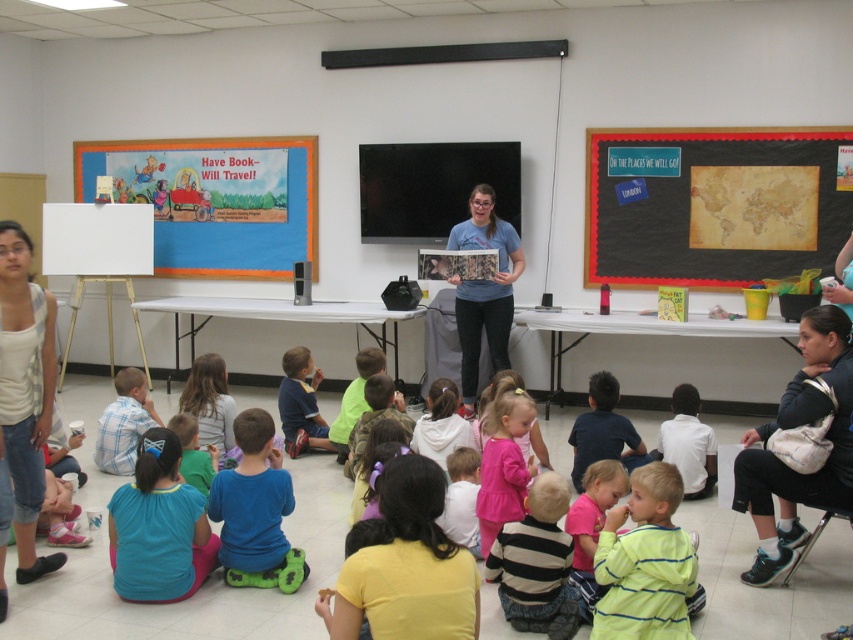
Question: Which of the following is the closest to the observer?

Choices:
 (A) (498, 408)
 (B) (189, 496)

Answer: (B)

Question: Based on their relative distances, which object is farther from the black fabric purse at lower right?

Choices:
 (A) blue fabric shirt at center
 (B) vintage paper map at upper right

Answer: (B)

Question: Is black fabric purse at lower right to the right of blue fabric shirt at center from the viewer's perspective?

Choices:
 (A) yes
 (B) no

Answer: (A)

Question: Is black fabric purse at lower right to the right of teal fabric shirt at lower left from the viewer's perspective?

Choices:
 (A) no
 (B) yes

Answer: (B)

Question: Is teal fabric shirt at lower left above dark blue shirt at center?

Choices:
 (A) no
 (B) yes

Answer: (A)

Question: Which point appears farthest from the camera in this image?

Choices:
 (A) (817, 500)
 (B) (282, 380)
 (C) (708, 435)

Answer: (B)